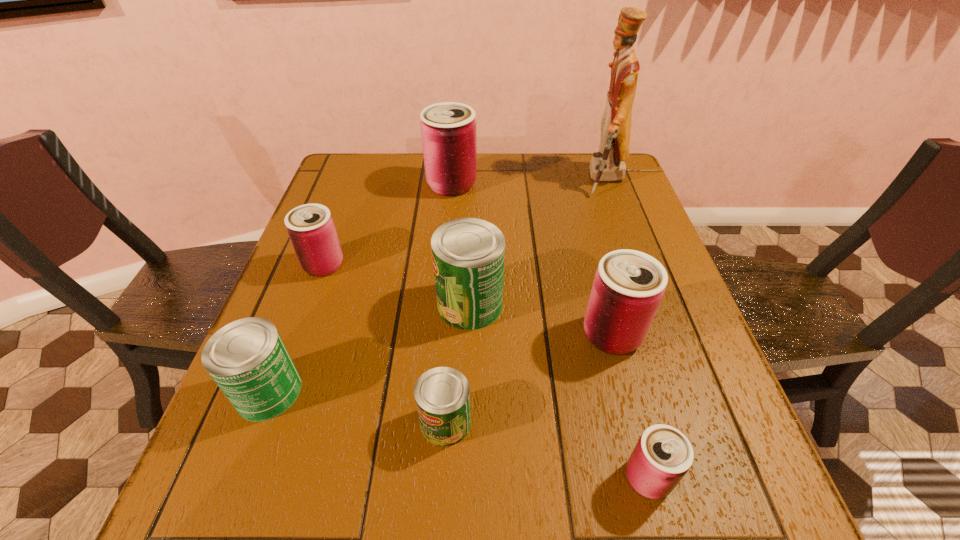
Locate an element on the screen. The height and width of the screenshot is (540, 960). vacant region at the left edge of the desktop is located at coordinates (269, 432).

The width and height of the screenshot is (960, 540). I want to click on vacant space at the right edge, so click(x=586, y=210).

Identify the location of vacant space at the far left corner of the desktop. pyautogui.click(x=329, y=183).

The height and width of the screenshot is (540, 960). Identify the location of empty space that is in between the biggest green can and the tallest object. (537, 241).

The image size is (960, 540). I want to click on empty space between the second smallest green can and the second pink can from left to right, so click(x=360, y=288).

Identify the location of vacant region between the farthest green can and the nearest can. (559, 391).

Where is `vacant area that lies between the nearest pink can and the sixth nearest can`? vacant area that lies between the nearest pink can and the sixth nearest can is located at coordinates (486, 372).

Image resolution: width=960 pixels, height=540 pixels. What are the coordinates of `vacant area between the farthest green can and the smallest green can` in the screenshot? It's located at (458, 363).

Find the location of a particular element. This screenshot has height=540, width=960. free space between the biggest green can and the smallest green can is located at coordinates (458, 363).

Identify the location of vacant area that lies between the smallest green can and the red nutcracker. (525, 301).